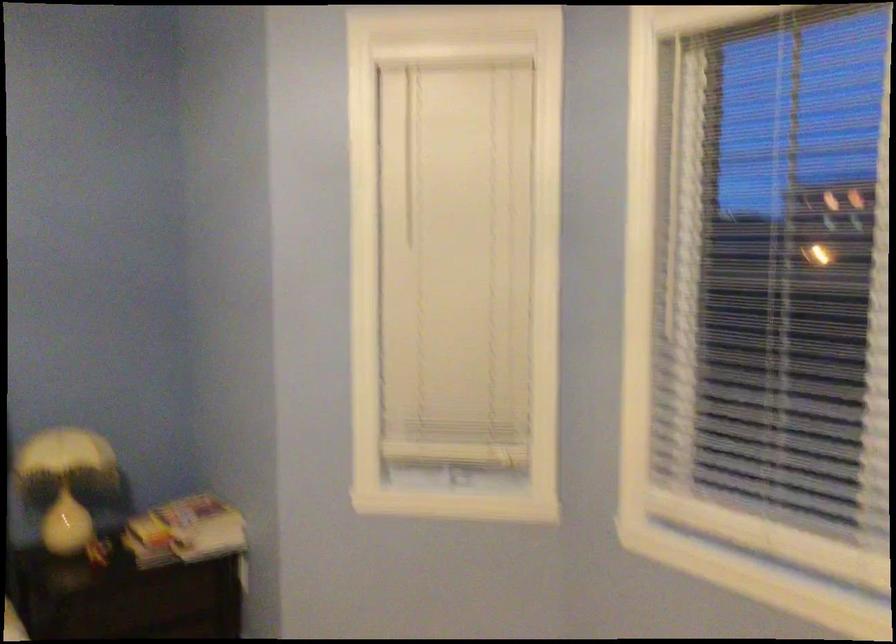
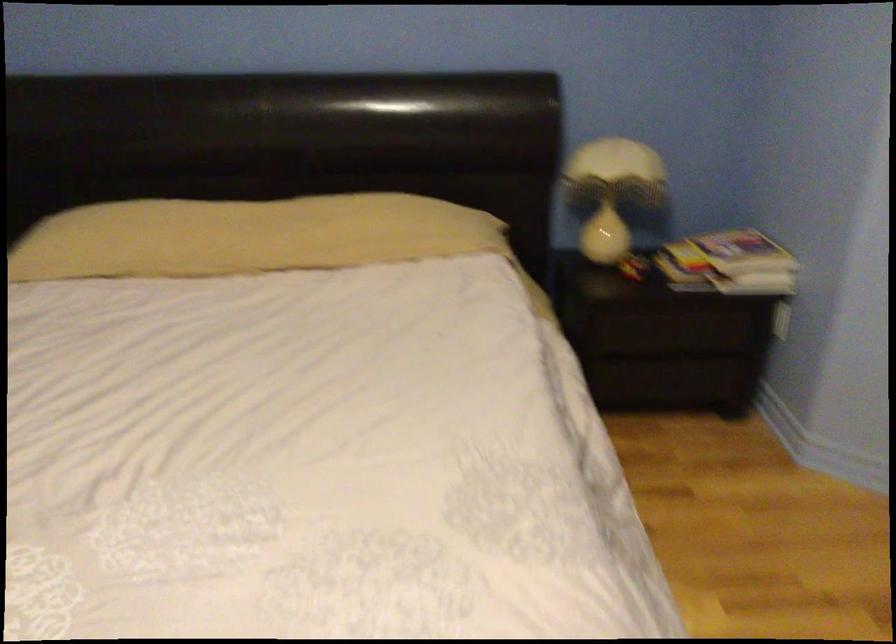
Locate, in the second image, the point that corresponds to pixel 186 536 in the first image.

(728, 263)